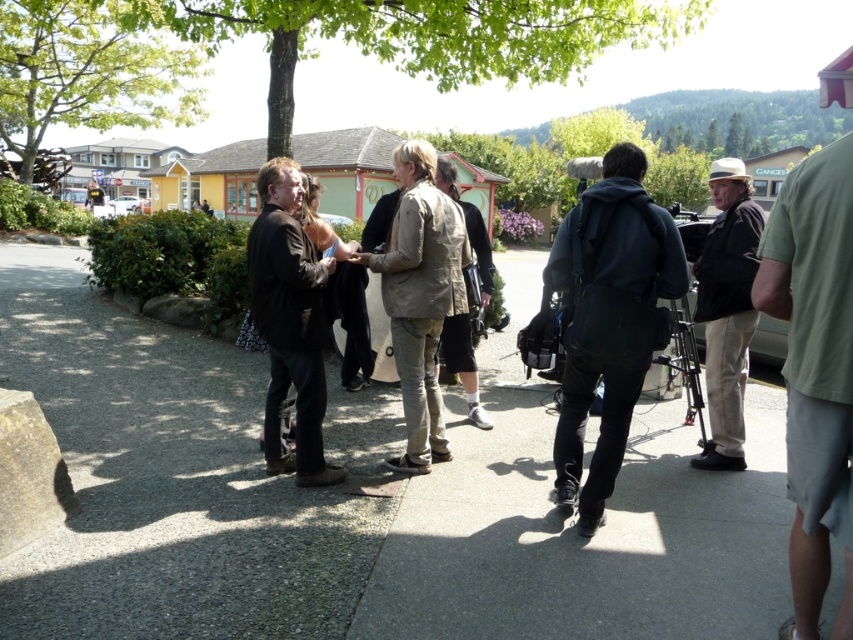
Who is more forward, [492,13] or [415,442]?

Point [415,442] is more forward.

Does green leafy tree at upper center have a lesser height compared to khaki textured jacket at center?

No.

Is point (693, 22) positioned before point (393, 214)?

No, it is behind (393, 214).

Image resolution: width=853 pixels, height=640 pixels. I want to click on green leafy tree at upper center, so click(x=421, y=36).

Can you confirm if gray asphalt at center is positioned below khaki fabric jacket at center?

Actually, gray asphalt at center is above khaki fabric jacket at center.

Is gray asphalt at center bigger than khaki fabric jacket at center?

Correct, gray asphalt at center is larger in size than khaki fabric jacket at center.

Where is `gray asphalt at center`? gray asphalt at center is located at coordinates (360, 500).

Does point (805, 189) lie in front of point (450, 164)?

That is True.

Is green cotton shirt at right thinner than khaki fabric jacket at center?

No.

This screenshot has width=853, height=640. In order to click on green cotton shirt at right in this screenshot , I will do `click(814, 371)`.